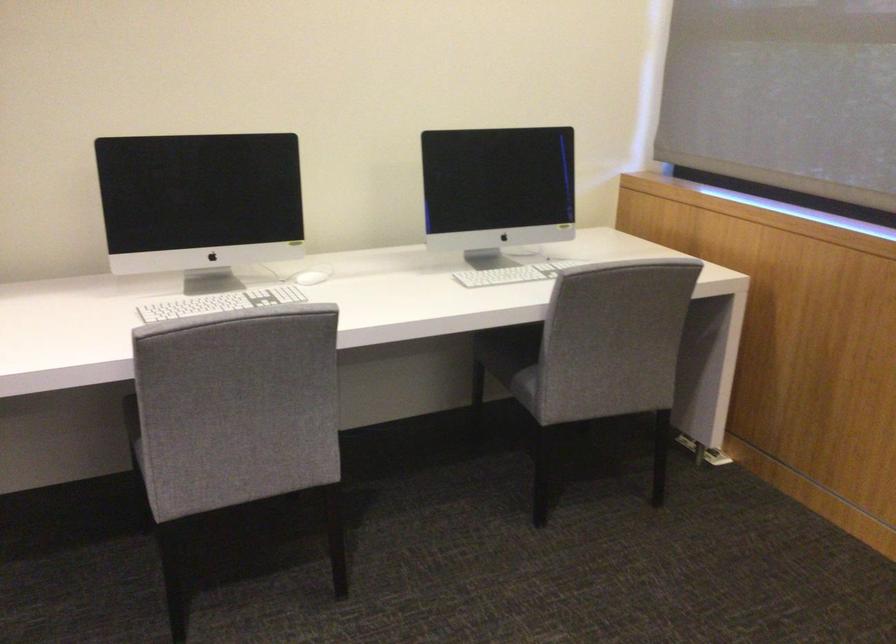
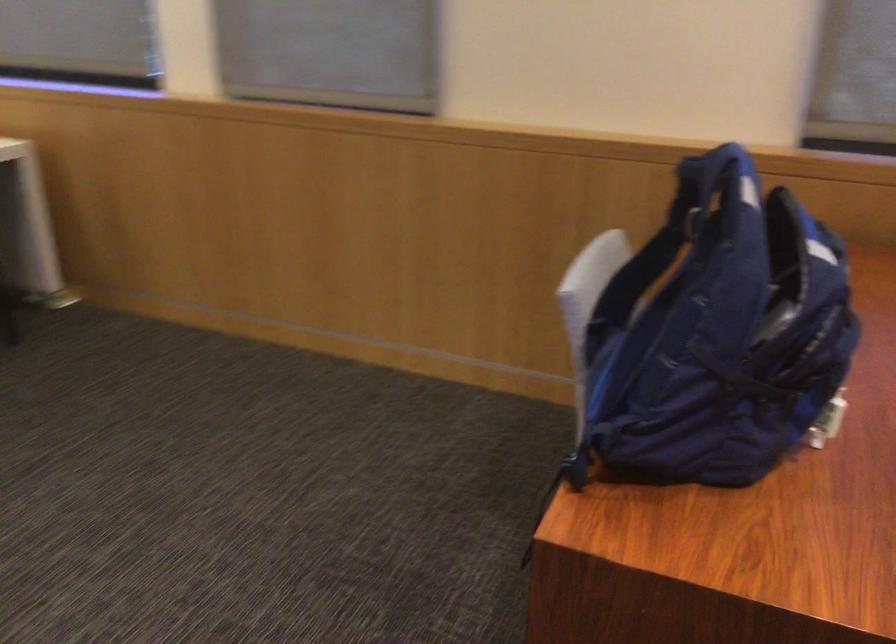
Question: The camera is either moving clockwise (left) or counter-clockwise (right) around the object. The first image is from the beginning of the video and the second image is from the end. Is the camera moving left or right when shooting the video?

Choices:
 (A) Left
 (B) Right

Answer: (A)